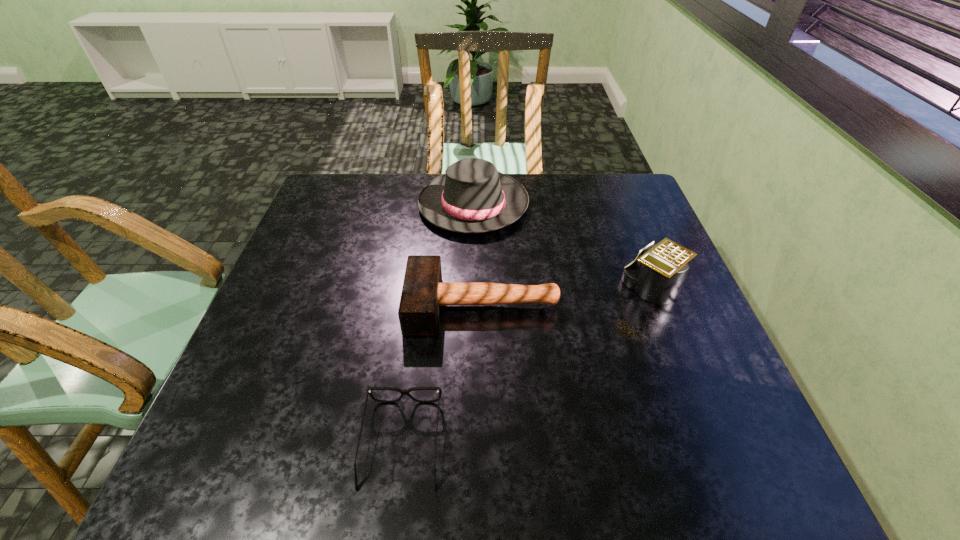
Identify the location of the farthest object. Image resolution: width=960 pixels, height=540 pixels. (472, 197).

Locate an element on the screen. Image resolution: width=960 pixels, height=540 pixels. the rightmost object is located at coordinates (657, 277).

At what (x,y) coordinates should I click in order to perform the action: click on the third tallest object. Please return your answer as a coordinate pair (x, y). Looking at the image, I should click on coord(423,292).

The height and width of the screenshot is (540, 960). What are the coordinates of `the nearest object` in the screenshot? It's located at (403, 392).

At what (x,y) coordinates should I click in order to perform the action: click on the shortest object. Please return your answer as a coordinate pair (x, y). Looking at the image, I should click on (403, 392).

Identify the location of blank area located 0.280m on the front of the dress hat. (471, 315).

Where is `free space located on the front of the rightmost object`? The height and width of the screenshot is (540, 960). free space located on the front of the rightmost object is located at coordinates (731, 481).

Where is `free space located on the hammer head face of the second shortest object`? The width and height of the screenshot is (960, 540). free space located on the hammer head face of the second shortest object is located at coordinates (365, 306).

This screenshot has width=960, height=540. Find the location of `free location located on the hammer head face of the second shortest object`. free location located on the hammer head face of the second shortest object is located at coordinates (352, 306).

Identify the location of free spot located on the hammer head face of the second shortest object. This screenshot has width=960, height=540. (294, 306).